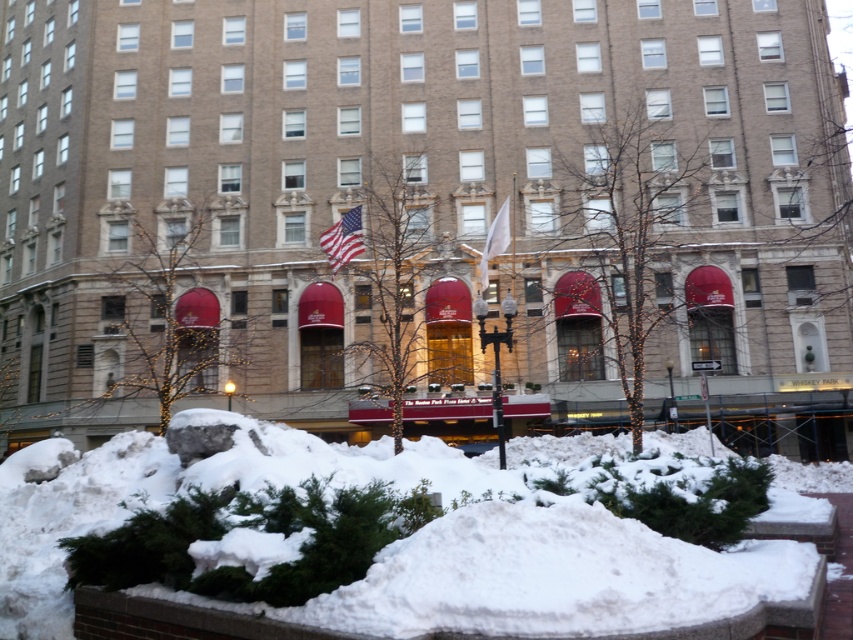
Describe the element at coordinates (426, 212) in the screenshot. I see `brown brick building at center` at that location.

Does brown brick building at center have a smaller size compared to white fabric flag at center?

Actually, brown brick building at center might be larger than white fabric flag at center.

Does point (178, 394) lie in front of point (498, 220)?

Yes, it is in front of point (498, 220).

Locate an element on the screen. This screenshot has height=640, width=853. brown brick building at center is located at coordinates (426, 212).

Is brown brick building at center above american flag at center?

Indeed, brown brick building at center is positioned over american flag at center.

Which is below, brown brick building at center or american flag at center?

american flag at center

Is point (782, 128) closer to camera compared to point (349, 221)?

No, it is behind (349, 221).

Where is `brown brick building at center`? The width and height of the screenshot is (853, 640). brown brick building at center is located at coordinates (426, 212).

Is brown brick building at center bigger than white fluffy snow at lower center?

Correct, brown brick building at center is larger in size than white fluffy snow at lower center.

What do you see at coordinates (426, 212) in the screenshot? This screenshot has width=853, height=640. I see `brown brick building at center` at bounding box center [426, 212].

The height and width of the screenshot is (640, 853). I want to click on brown brick building at center, so click(426, 212).